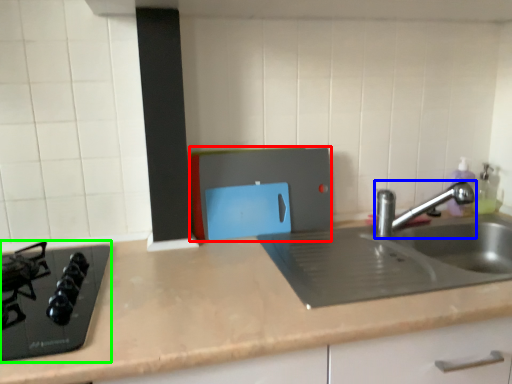
Question: Estimate the real-world distances between objects in this image. Which object is farther from appliance (highlighted by a red box), tap (highlighted by a blue box) or gas stove (highlighted by a green box)?

Choices:
 (A) tap
 (B) gas stove

Answer: (B)